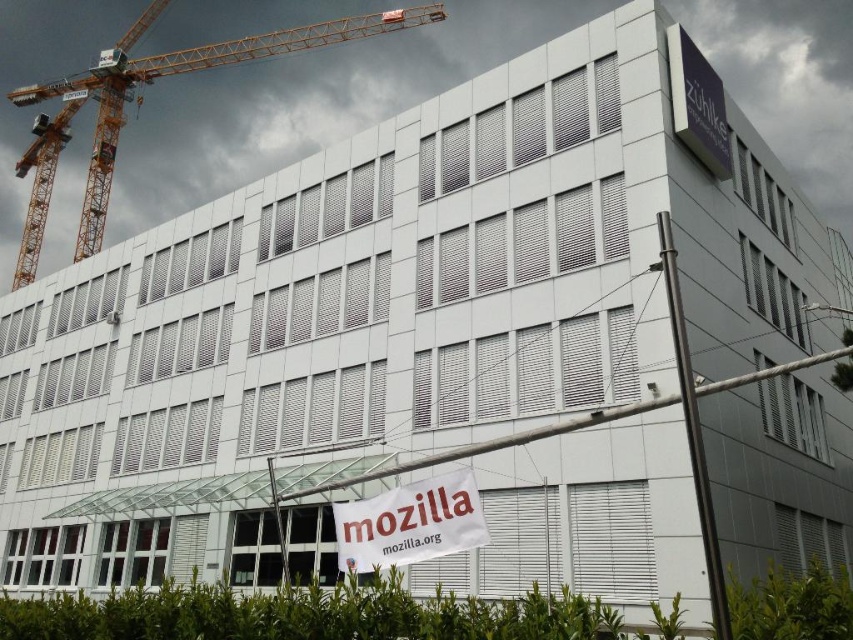
Question: Is yellow metal crane at upper left to the right of white fabric banner at center from the viewer's perspective?

Choices:
 (A) yes
 (B) no

Answer: (B)

Question: Is yellow metal crane at upper left to the left of white fabric banner at center from the viewer's perspective?

Choices:
 (A) no
 (B) yes

Answer: (B)

Question: Does yellow metal crane at upper left appear under white fabric banner at center?

Choices:
 (A) no
 (B) yes

Answer: (A)

Question: Among these points, which one is farthest from the camera?

Choices:
 (A) (103, 204)
 (B) (352, 502)

Answer: (A)